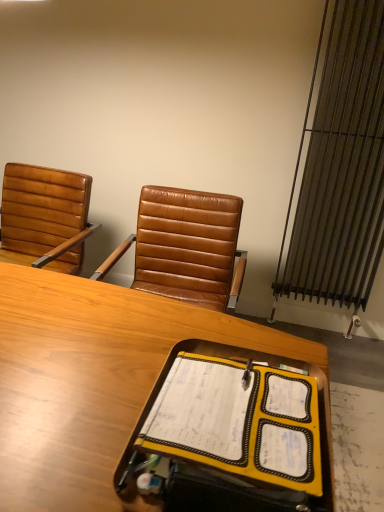
Question: Considering the relative sizes of wooden desk at center and metallic silver radiator at right in the image provided, is wooden desk at center taller than metallic silver radiator at right?

Choices:
 (A) no
 (B) yes

Answer: (A)

Question: Considering the relative sizes of wooden desk at center and metallic silver radiator at right in the image provided, is wooden desk at center smaller than metallic silver radiator at right?

Choices:
 (A) no
 (B) yes

Answer: (A)

Question: Are wooden desk at center and metallic silver radiator at right far apart?

Choices:
 (A) no
 (B) yes

Answer: (B)

Question: Is the depth of wooden desk at center less than that of metallic silver radiator at right?

Choices:
 (A) no
 (B) yes

Answer: (B)

Question: Is wooden desk at center aimed at metallic silver radiator at right?

Choices:
 (A) no
 (B) yes

Answer: (A)

Question: Considering the positions of wooden desk at center and brown leather chair at left in the image, is wooden desk at center taller or shorter than brown leather chair at left?

Choices:
 (A) tall
 (B) short

Answer: (A)

Question: Is wooden desk at center in front of or behind brown leather chair at left in the image?

Choices:
 (A) behind
 (B) front

Answer: (B)

Question: Looking at the image, does wooden desk at center seem bigger or smaller compared to brown leather chair at left?

Choices:
 (A) small
 (B) big

Answer: (B)

Question: In the image, is wooden desk at center on the left side or the right side of brown leather chair at left?

Choices:
 (A) left
 (B) right

Answer: (B)

Question: Is yellow fabric notebook at center inside the boundaries of wooden desk at center, or outside?

Choices:
 (A) outside
 (B) inside

Answer: (A)

Question: In terms of width, does yellow fabric notebook at center look wider or thinner when compared to wooden desk at center?

Choices:
 (A) wide
 (B) thin

Answer: (B)

Question: Considering the relative positions of yellow fabric notebook at center and wooden desk at center in the image provided, is yellow fabric notebook at center to the left or to the right of wooden desk at center?

Choices:
 (A) right
 (B) left

Answer: (A)

Question: From the image's perspective, is yellow fabric notebook at center positioned above or below wooden desk at center?

Choices:
 (A) above
 (B) below

Answer: (A)

Question: Does point (64, 375) appear closer or farther from the camera than point (372, 45)?

Choices:
 (A) closer
 (B) farther

Answer: (A)

Question: Is wooden desk at center in front of or behind metallic silver radiator at right in the image?

Choices:
 (A) behind
 (B) front

Answer: (B)